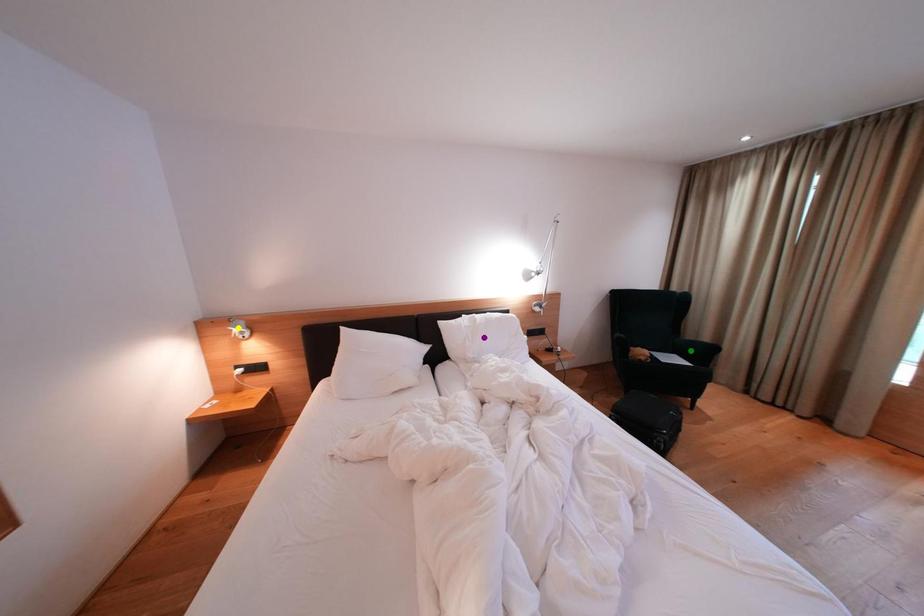
Order these from farthest to nearest:
green point
purple point
yellow point

green point
purple point
yellow point